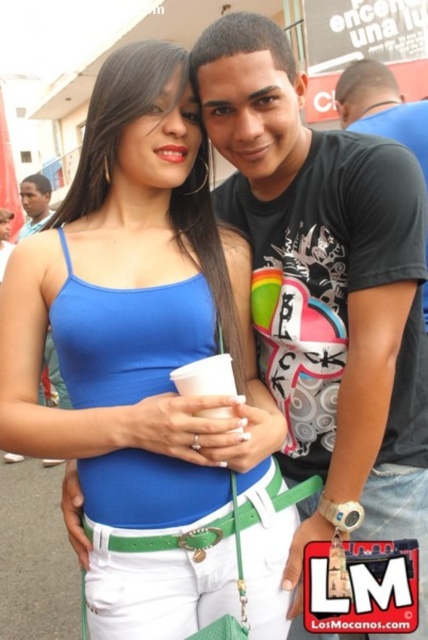
Who is lower down, black matte t-shirt at center or matte black headband at upper left?

black matte t-shirt at center is lower down.

Who is more forward, (356, 262) or (44, 202)?

Point (356, 262) is in front.

Identify the location of black matte t-shirt at center. Image resolution: width=428 pixels, height=640 pixels. (326, 289).

Where is `matte blue tank top at center`? matte blue tank top at center is located at coordinates (139, 349).

Can you confirm if matte blue tank top at center is bigger than black matte t-shirt at center?

Incorrect, matte blue tank top at center is not larger than black matte t-shirt at center.

Is point (205, 156) in front of point (416, 360)?

No, it is behind (416, 360).

You are a GUI agent. You are given a task and a screenshot of the screen. Output one action in this format:
    pyautogui.click(x=<x>, y=<y>)
    Task: Click on the matte blue tank top at center
    The image size is (428, 640).
    Given the screenshot: What is the action you would take?
    pyautogui.click(x=139, y=349)

Who is positioned more to the right, matte blue tank top at center or matte black headband at upper left?

matte blue tank top at center is more to the right.

Is point (184, 352) positioned in front of point (29, 205)?

Yes.

The height and width of the screenshot is (640, 428). In order to click on matte blue tank top at center in this screenshot , I will do `click(139, 349)`.